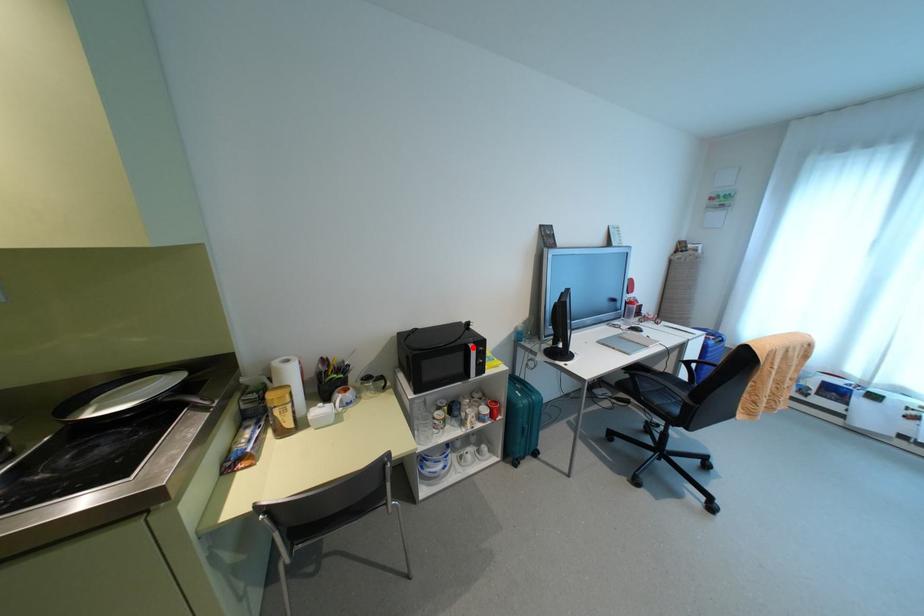
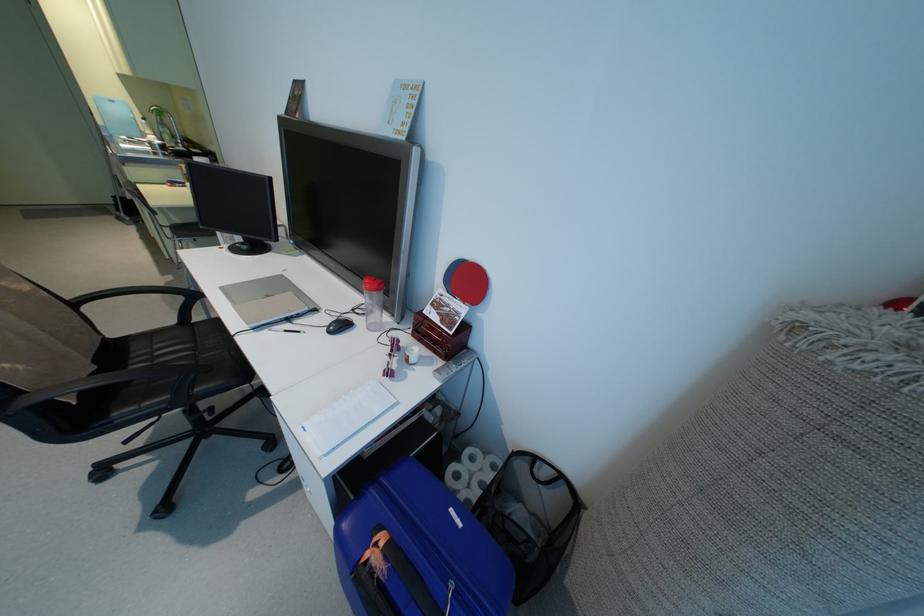
Question: I am providing you with two images of the same scene from different viewpoints. A red point is marked on the first image. Can you still see the location of the red point in image 2?

Choices:
 (A) Yes
 (B) No

Answer: (B)